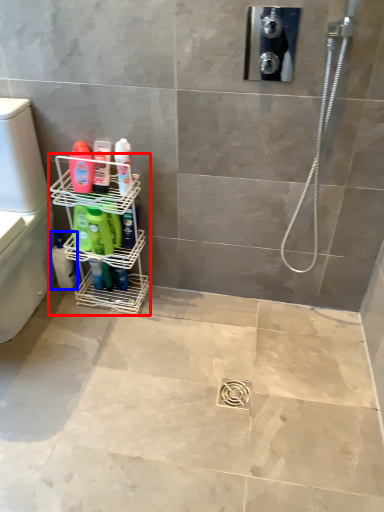
Question: Among these objects, which one is farthest to the camera, shelf (highlighted by a red box) or cleaning product (highlighted by a blue box)?

Choices:
 (A) shelf
 (B) cleaning product

Answer: (B)